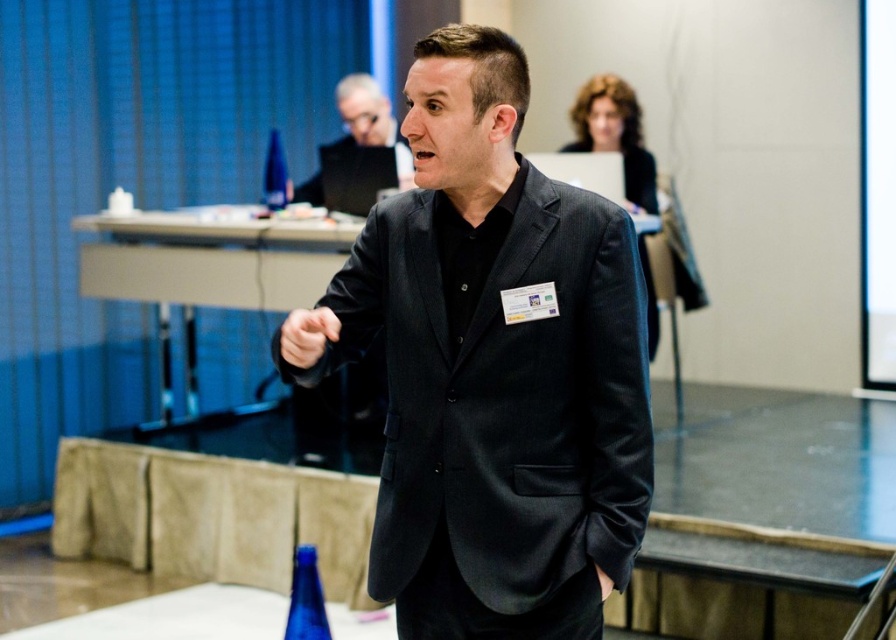
Question: Does matte black suit at center appear under black matte suit at center?

Choices:
 (A) no
 (B) yes

Answer: (B)

Question: Is matte black suit at center positioned at the back of black matte suit at center?

Choices:
 (A) no
 (B) yes

Answer: (A)

Question: Which point is closer to the camera taking this photo?

Choices:
 (A) (409, 157)
 (B) (423, 212)

Answer: (B)

Question: In this image, where is matte black suit at center located relative to black matte suit at center?

Choices:
 (A) right
 (B) left

Answer: (A)